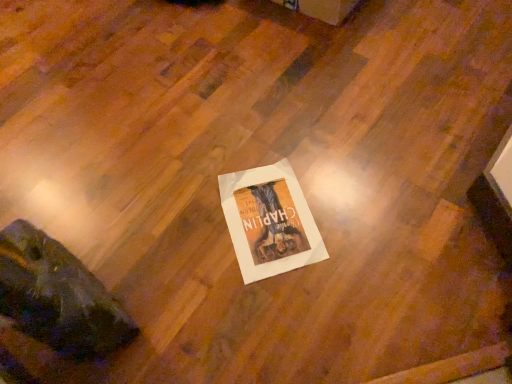
The width and height of the screenshot is (512, 384). What do you see at coordinates (269, 221) in the screenshot?
I see `white paper book at center` at bounding box center [269, 221].

The image size is (512, 384). Find the location of `white paper book at center`. white paper book at center is located at coordinates (269, 221).

You are a GUI agent. You are given a task and a screenshot of the screen. Output one action in this format:
    pyautogui.click(x=<x>, y=<y>)
    Task: Click on the white paper book at center
    Image resolution: width=512 pixels, height=384 pixels.
    Given the screenshot: What is the action you would take?
    coord(269,221)